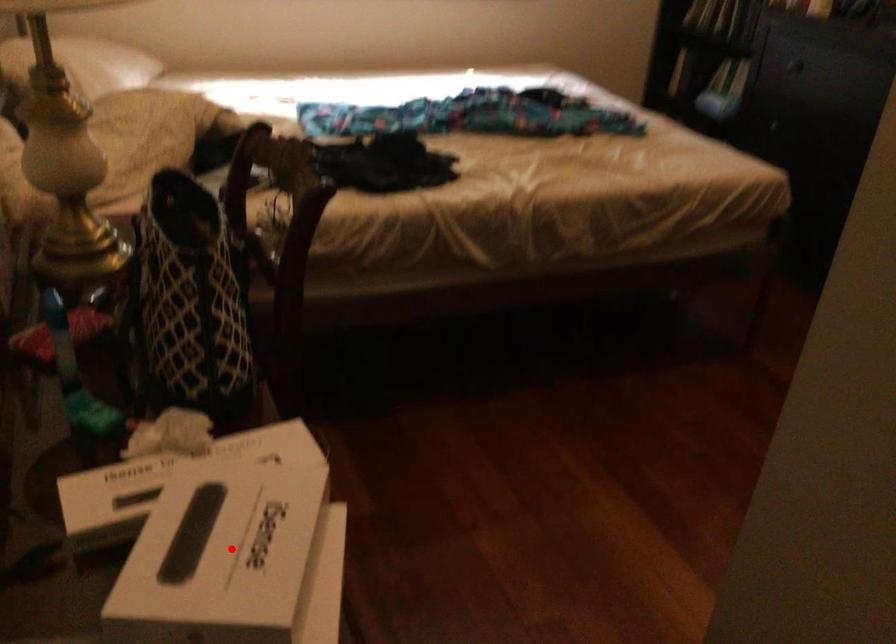
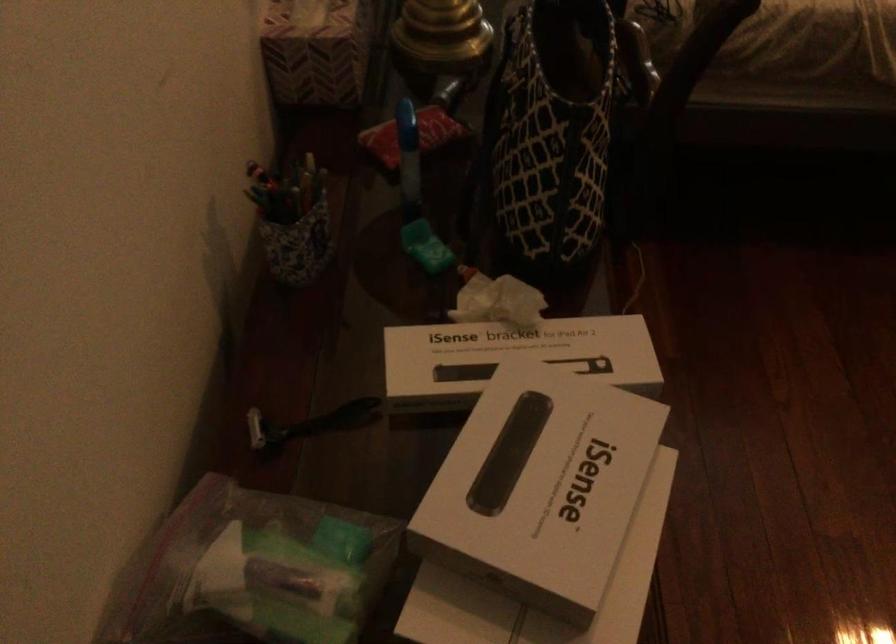
Question: I am providing you with two images of the same scene from different viewpoints. A red point is shown in image1. For the corresponding object point in image2, is it positioned nearer or farther from the camera?

Choices:
 (A) Nearer
 (B) Farther

Answer: (A)